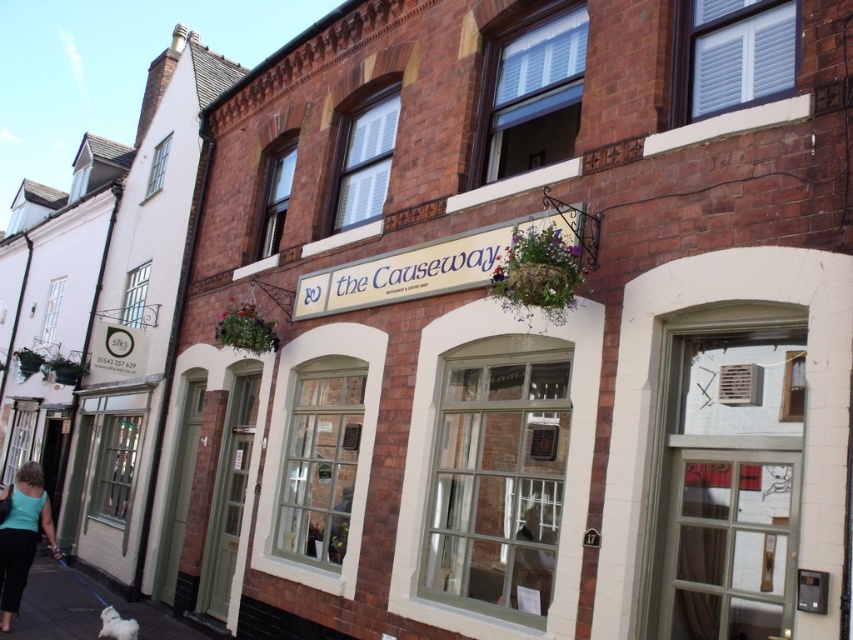
You are standing in front of the brick building and notice a teal fabric top at lower left. If you want to locate it precisely, what are its coordinates?

The teal fabric top at lower left is located at coordinates point (21,536).

You are a customer entering The Causeway and see a teal fabric top at lower left and a white fluffy dog at lower left. Which item is more to the left?

The teal fabric top at lower left is more on the left side than the white fluffy dog at lower left.

You are a delivery person approaching the entrance of The Causeway. You need to park your bike near the black asphalt pavement at lower left and the teal fabric top at lower left. Which object should you park closer to if you want your bike to be on the path leading to the entrance?

You should park closer to the black asphalt pavement at lower left because it is in front of the teal fabric top at lower left, meaning the pavement is part of the path leading to the entrance.